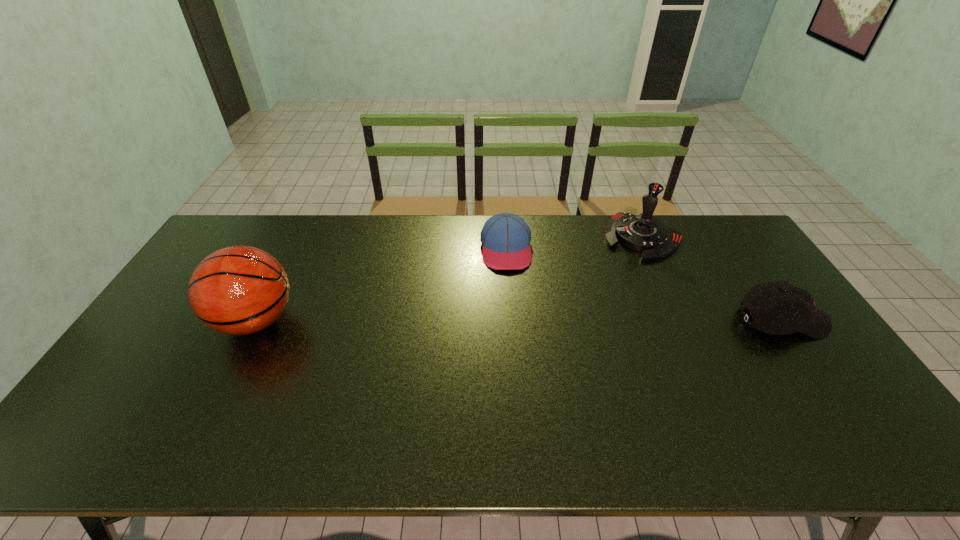
Where is `free space on the desktop that is between the basketball and the nearer baseball cap and is positioned on the front-facing side of the left baseball cap`? Image resolution: width=960 pixels, height=540 pixels. free space on the desktop that is between the basketball and the nearer baseball cap and is positioned on the front-facing side of the left baseball cap is located at coordinates (x=514, y=320).

Find the location of `free space on the desktop that is between the tallest object and the rightmost object and is positioned on the handle side of the joystick`. free space on the desktop that is between the tallest object and the rightmost object and is positioned on the handle side of the joystick is located at coordinates (576, 320).